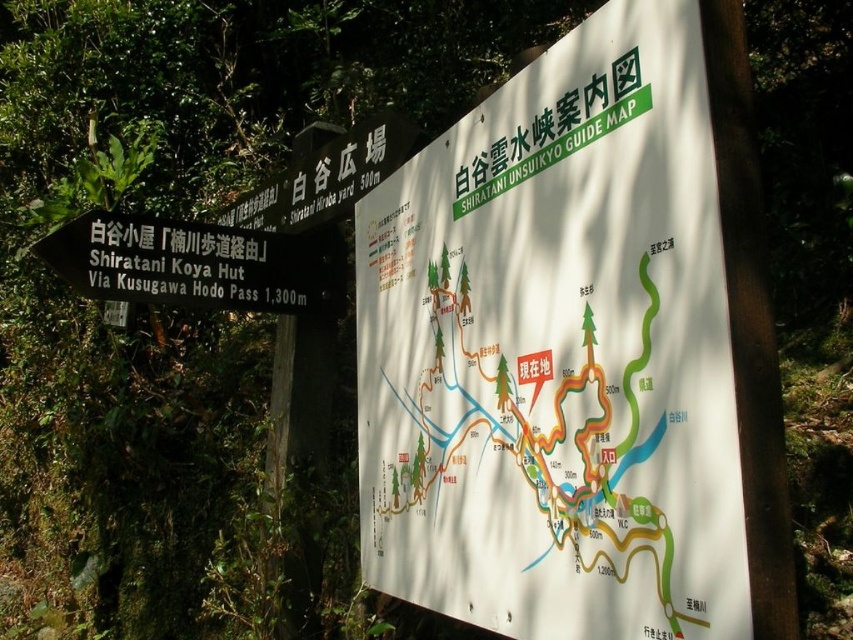
Question: Can you confirm if white matte guide map at center is wider than black plastic sign at left?

Choices:
 (A) yes
 (B) no

Answer: (B)

Question: Among these points, which one is farthest from the camera?

Choices:
 (A) (442, 323)
 (B) (91, 218)

Answer: (B)

Question: Is white matte guide map at center behind black plastic sign at left?

Choices:
 (A) no
 (B) yes

Answer: (A)

Question: Can you confirm if white matte guide map at center is wider than black plastic sign at left?

Choices:
 (A) no
 (B) yes

Answer: (A)